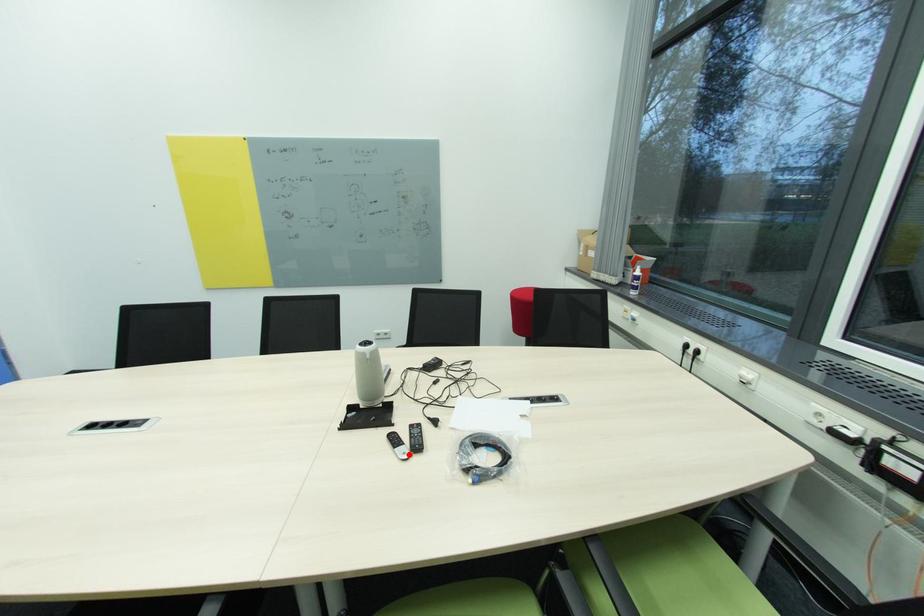
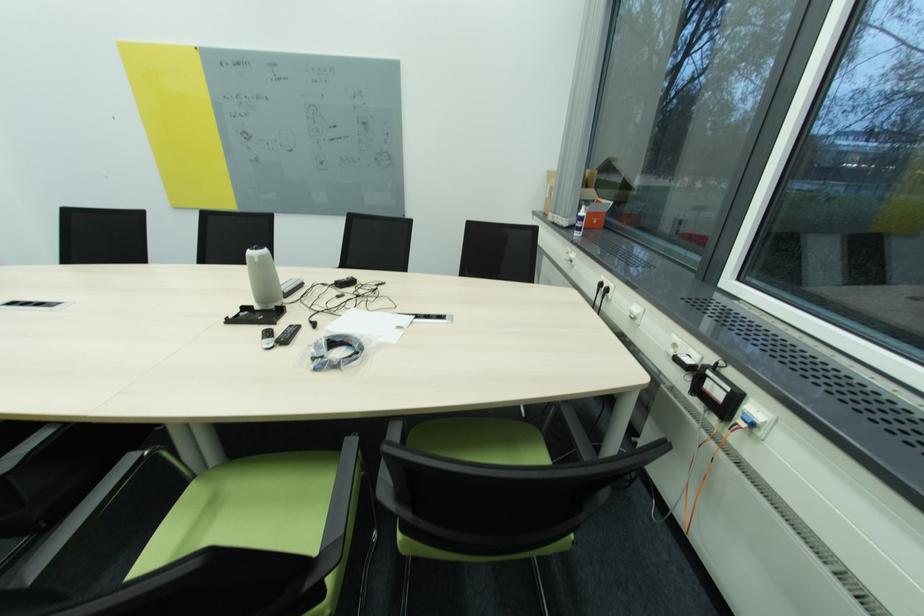
In the second image, find the point that corresponds to the highlighted location in the first image.

(273, 345)